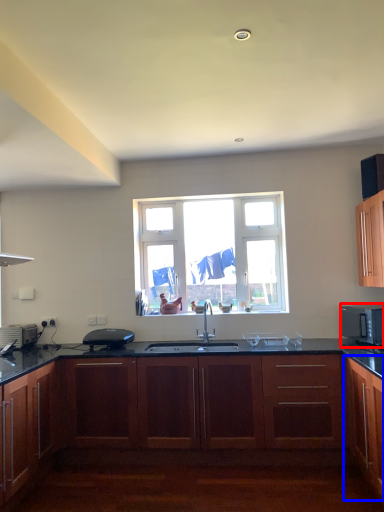
Question: Which of the following is the farthest to the observer, microwave oven (highlighted by a red box) or cabinetry (highlighted by a blue box)?

Choices:
 (A) microwave oven
 (B) cabinetry

Answer: (A)